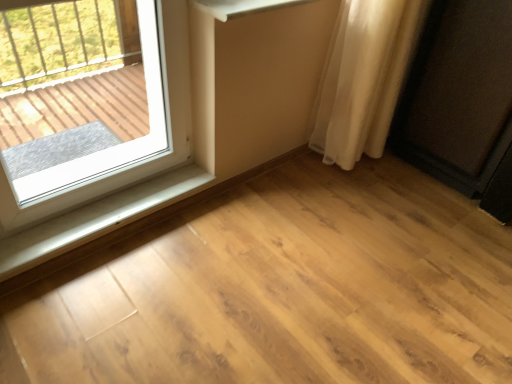
You are a GUI agent. You are given a task and a screenshot of the screen. Output one action in this format:
    pyautogui.click(x=<x>, y=<y>)
    Task: Click on the blank area beneath white plastic window at upper left (from a real-world perspective)
    The width and height of the screenshot is (512, 384).
    Given the screenshot: What is the action you would take?
    pyautogui.click(x=99, y=202)